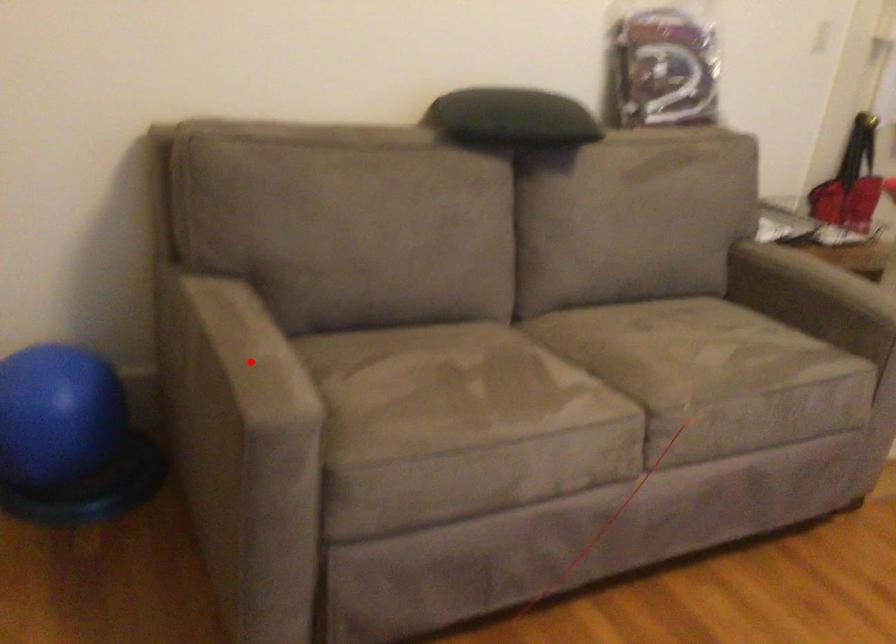
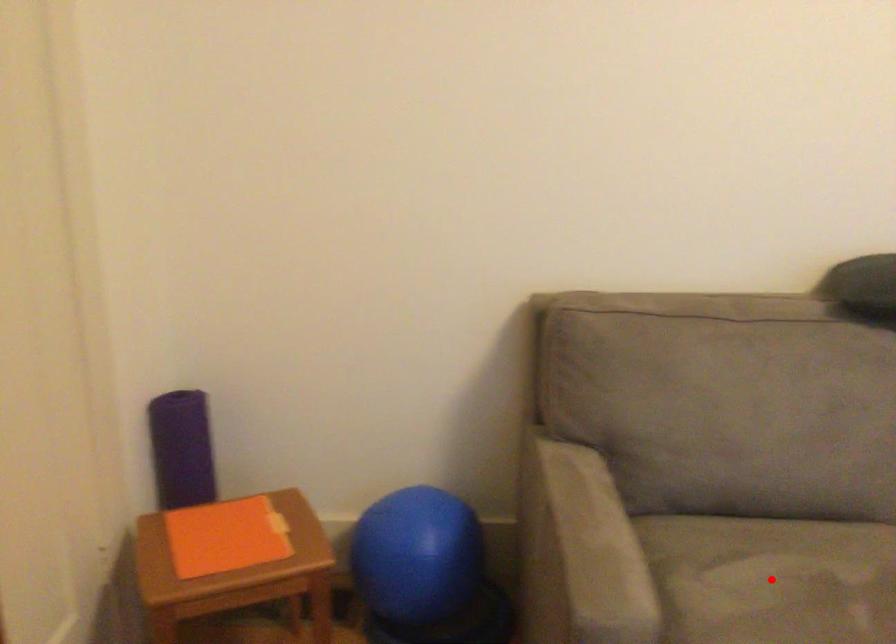
I am providing you with two images of the same scene from different viewpoints. A red point is marked on the first image and another point is marked on the second image. Is the red point in image1 aligned with the point shown in image2?

No